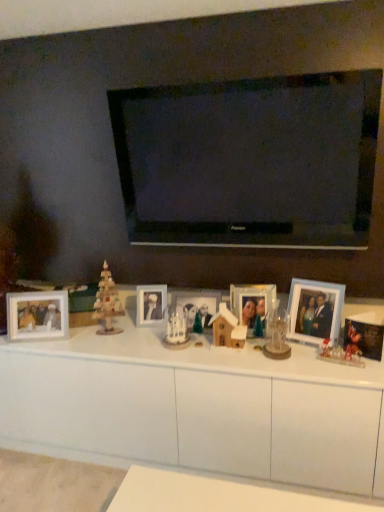
Where is `free space in front of wooden christmas tree at left`? This screenshot has height=512, width=384. free space in front of wooden christmas tree at left is located at coordinates 107,345.